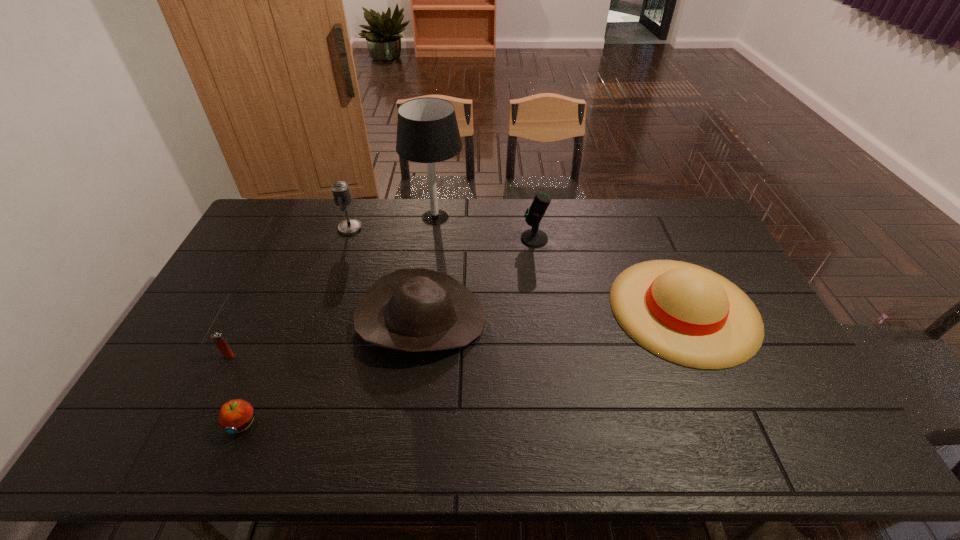
Locate an element on the screen. free space at the near edge is located at coordinates (481, 436).

At what (x,y) coordinates should I click in order to perform the action: click on free space at the left edge of the desktop. Please return your answer as a coordinate pair (x, y). The height and width of the screenshot is (540, 960). Looking at the image, I should click on (264, 275).

You are a GUI agent. You are given a task and a screenshot of the screen. Output one action in this format:
    pyautogui.click(x=<x>, y=<y>)
    Task: Click on the vacant space at the right edge of the desktop
    
    Given the screenshot: What is the action you would take?
    pyautogui.click(x=689, y=252)

The image size is (960, 540). I want to click on free space between the sombrero and the sixth object from left to right, so click(x=609, y=274).

Locate an element on the screen. The image size is (960, 540). vacant region between the sixth object from left to right and the tallest object is located at coordinates (485, 228).

At what (x,y) coordinates should I click in order to perform the action: click on vacant space that's between the third object from left to right and the sixth object from right to left. Please return your answer as a coordinate pair (x, y). The width and height of the screenshot is (960, 540). Looking at the image, I should click on (296, 326).

You are a GUI agent. You are given a task and a screenshot of the screen. Output one action in this format:
    pyautogui.click(x=<x>, y=<y>)
    Task: Click on the unoccupied area between the fifth object from right to left and the cowboy hat
    Image resolution: width=960 pixels, height=540 pixels.
    Given the screenshot: What is the action you would take?
    pyautogui.click(x=385, y=274)

I want to click on free space between the right microphone and the third object from left to right, so click(x=443, y=233).

Where is `empty space between the table lamp and the sombrero`? This screenshot has height=540, width=960. empty space between the table lamp and the sombrero is located at coordinates (560, 263).

At what (x,y) coordinates should I click in order to perform the action: click on empty location between the right microphone and the left microphone. Please return your answer as a coordinate pair (x, y). The width and height of the screenshot is (960, 540). Looking at the image, I should click on (443, 233).